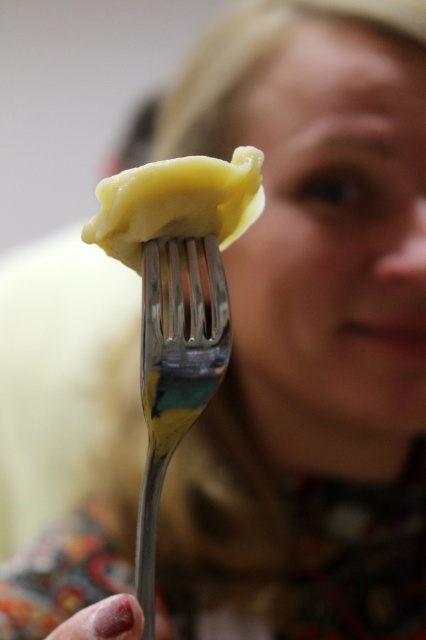
Question: Does silver metallic fork at center have a lesser width compared to yellow matte dumpling at center?

Choices:
 (A) yes
 (B) no

Answer: (A)

Question: Among these points, which one is farthest from the camera?

Choices:
 (A) (141, 563)
 (B) (106, 179)

Answer: (B)

Question: From the image, what is the correct spatial relationship of silver metallic fork at center in relation to yellow matte dumpling at center?

Choices:
 (A) above
 (B) below

Answer: (B)

Question: Where is silver metallic fork at center located in relation to yellow matte dumpling at center in the image?

Choices:
 (A) right
 (B) left

Answer: (B)